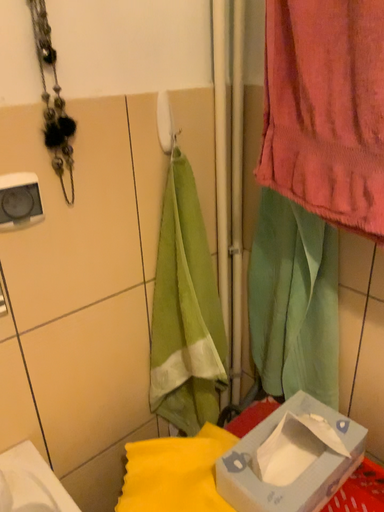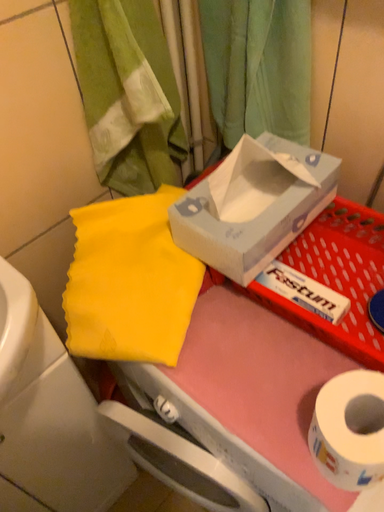
Question: Which way did the camera rotate in the video?

Choices:
 (A) rotated upward
 (B) rotated downward

Answer: (B)